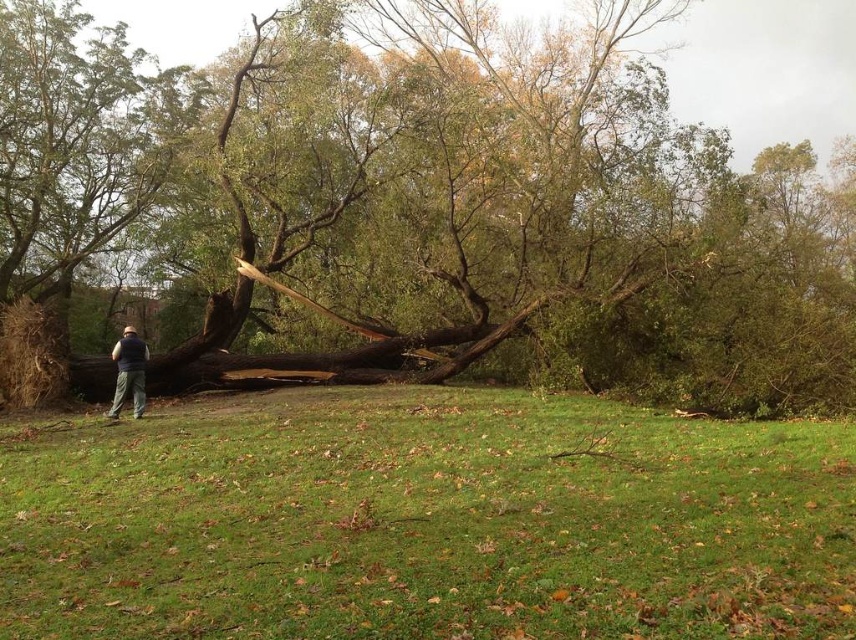
You are a hiker who has just arrived at the park and see the brown rough wood at center and the dark blue vest at lower left. Which object is higher up in the scene?

The brown rough wood at center is located above the dark blue vest at lower left, so it is higher up in the scene.

You are standing at the point labeled point (415, 204) in the image. What type of surface are you standing on?

The point (415, 204) is on brown rough wood at center.